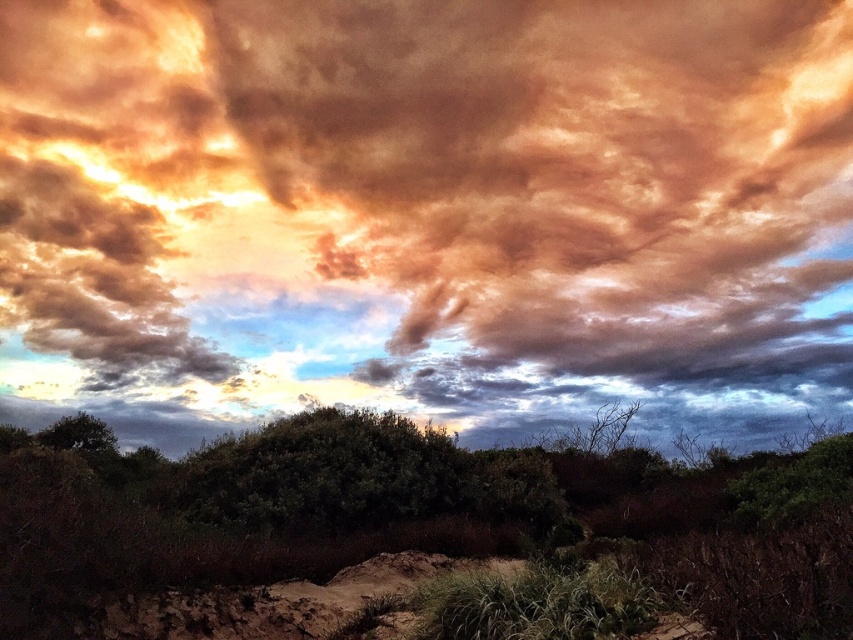
Question: Among these points, which one is nearest to the camera?

Choices:
 (A) (834, 518)
 (B) (323, 259)

Answer: (A)

Question: Which of the following is the closest to the observer?

Choices:
 (A) (817, 534)
 (B) (512, 380)

Answer: (A)

Question: Is matte orange cloud at upper center wider than green matte shrubs at center?

Choices:
 (A) no
 (B) yes

Answer: (B)

Question: Is matte orange cloud at upper center thinner than green matte shrubs at center?

Choices:
 (A) no
 (B) yes

Answer: (A)

Question: Which point is farther to the camera?

Choices:
 (A) (850, 433)
 (B) (526, 93)

Answer: (B)

Question: Is matte orange cloud at upper center bigger than green matte shrubs at center?

Choices:
 (A) no
 (B) yes

Answer: (B)